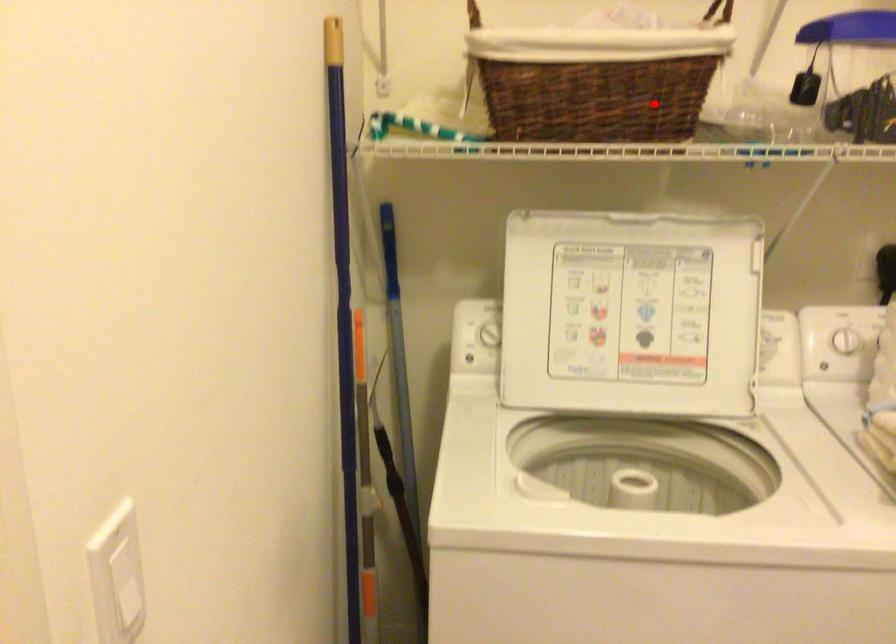
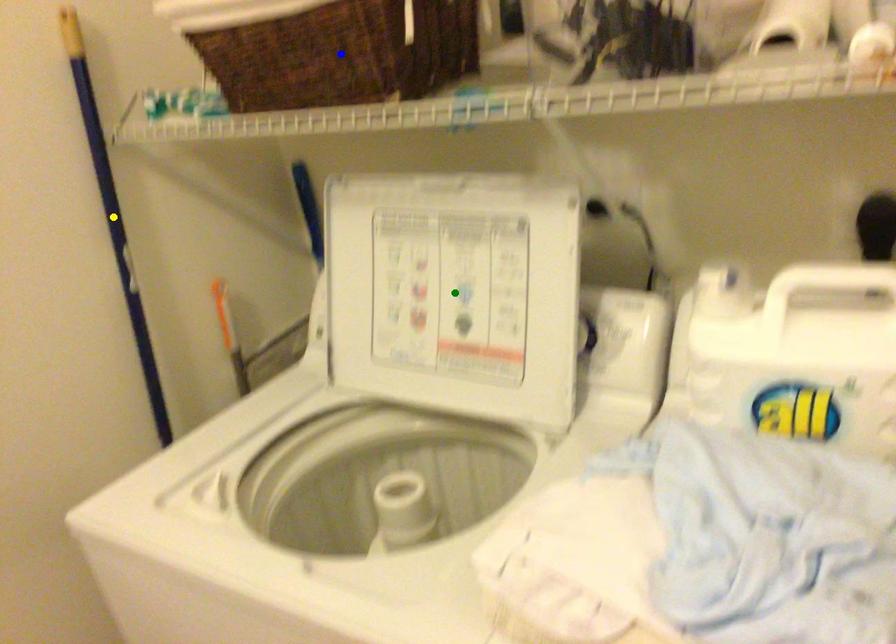
Question: I am providing you with two images of the same scene from different viewpoints. A red point is marked on the first image. You are given multiple points on the second image. Can you choose the point in image 2 that corresponds to the point in image 1?

Choices:
 (A) yellow point
 (B) blue point
 (C) green point

Answer: (B)